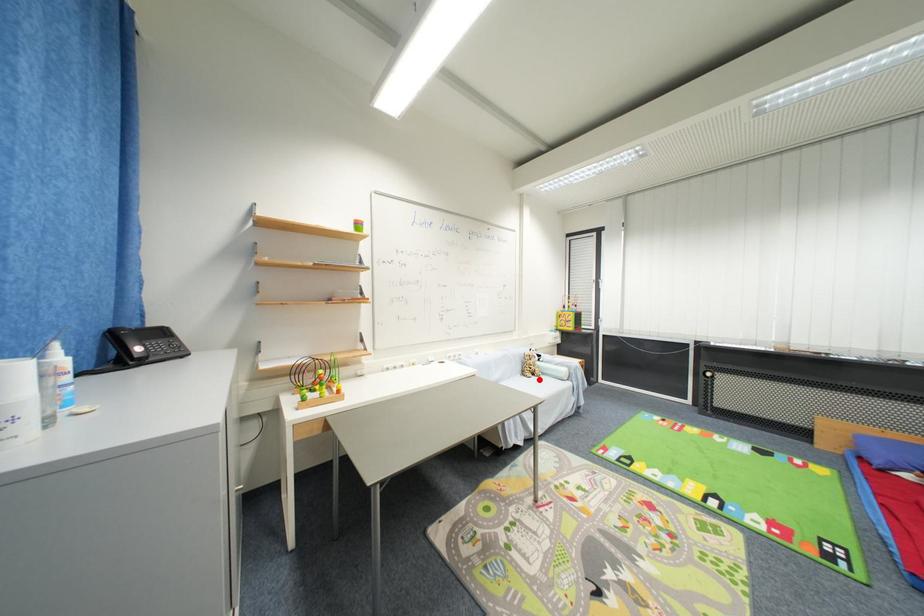
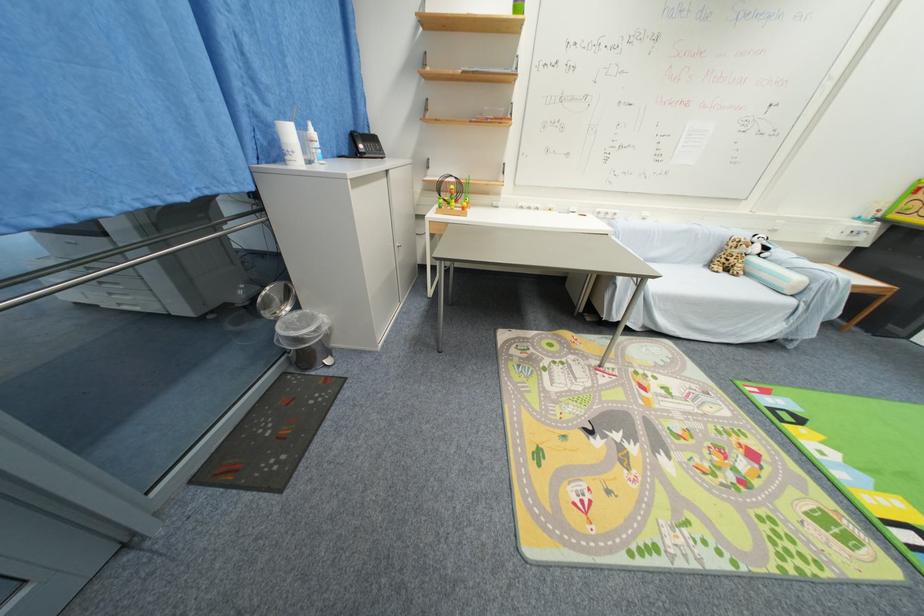
Question: I am providing you with two images of the same scene from different viewpoints. Given a red point in image1, look at the same physical point in image2. Is it:

Choices:
 (A) Closer to the viewpoint
 (B) Farther from the viewpoint

Answer: (A)